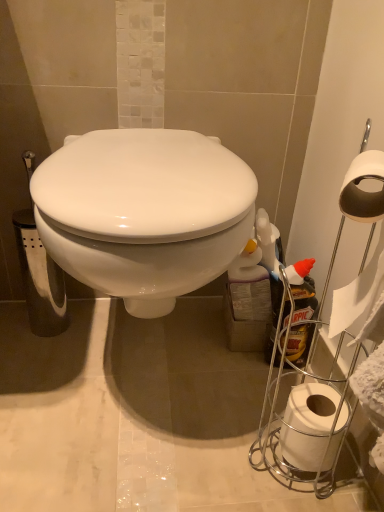
Question: Considering the positions of white plastic spray bottle at right and white paper at right in the image, is white plastic spray bottle at right taller or shorter than white paper at right?

Choices:
 (A) tall
 (B) short

Answer: (A)

Question: Is white plastic spray bottle at right to the left or to the right of white paper at right in the image?

Choices:
 (A) right
 (B) left

Answer: (A)

Question: From the image's perspective, is white plastic spray bottle at right located above or below white paper at right?

Choices:
 (A) below
 (B) above

Answer: (B)

Question: In terms of width, does white paper at right look wider or thinner when compared to white plastic spray bottle at right?

Choices:
 (A) wide
 (B) thin

Answer: (A)

Question: Is white paper at right bigger or smaller than white plastic spray bottle at right?

Choices:
 (A) big
 (B) small

Answer: (B)

Question: From a real-world perspective, is white paper at right positioned above or below white plastic spray bottle at right?

Choices:
 (A) below
 (B) above

Answer: (A)

Question: Relative to white plastic spray bottle at right, is white paper at right in front or behind?

Choices:
 (A) behind
 (B) front

Answer: (B)